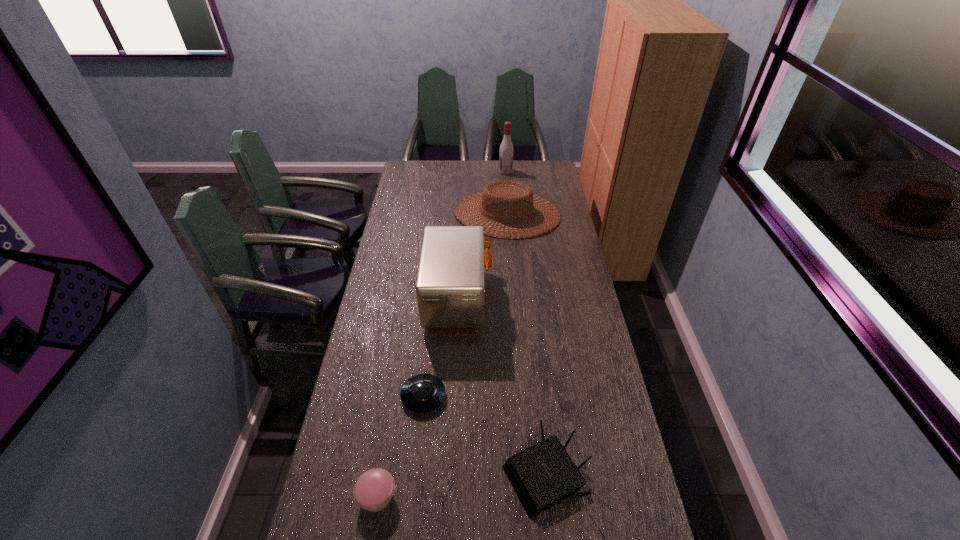
Where is `sunhat located at the right edge`? Image resolution: width=960 pixels, height=540 pixels. sunhat located at the right edge is located at coordinates (489, 193).

You are a GUI agent. You are given a task and a screenshot of the screen. Output one action in this format:
    pyautogui.click(x=<x>, y=<y>)
    Task: Click on the router situated at the right edge
    This screenshot has width=960, height=540.
    Given the screenshot: What is the action you would take?
    pyautogui.click(x=542, y=475)

At what (x,y) coordinates should I click in order to perform the action: click on free space at the far edge. Please return your answer as a coordinate pair (x, y). The height and width of the screenshot is (540, 960). Looking at the image, I should click on (470, 160).

Image resolution: width=960 pixels, height=540 pixels. Identify the location of free space at the left edge of the desktop. (316, 518).

In the image, there is a desktop. At what (x,y) coordinates should I click in order to perform the action: click on vacant space at the right edge. Please return your answer as a coordinate pair (x, y). This screenshot has height=540, width=960. Looking at the image, I should click on (590, 372).

The width and height of the screenshot is (960, 540). I want to click on free space at the far left corner of the desktop, so click(x=409, y=173).

You are a GUI agent. You are given a task and a screenshot of the screen. Output one action in this format:
    pyautogui.click(x=<x>, y=<y>)
    Task: Click on the free space between the fourth tallest object and the saucer
    This screenshot has width=960, height=540.
    Given the screenshot: What is the action you would take?
    484,435

I want to click on object that ranks as the second closest to the fourth nearest object, so click(421, 393).

Find the location of a particular element. Image resolution: width=960 pixels, height=540 pixels. object that is the third closest to the alcohol is located at coordinates [x=421, y=393].

Locate an element on the screen. The width and height of the screenshot is (960, 540). free spot that satisfies the following two spatial constraints: 1. on the front side of the third shortest object; 2. on the left side of the sunhat is located at coordinates (527, 474).